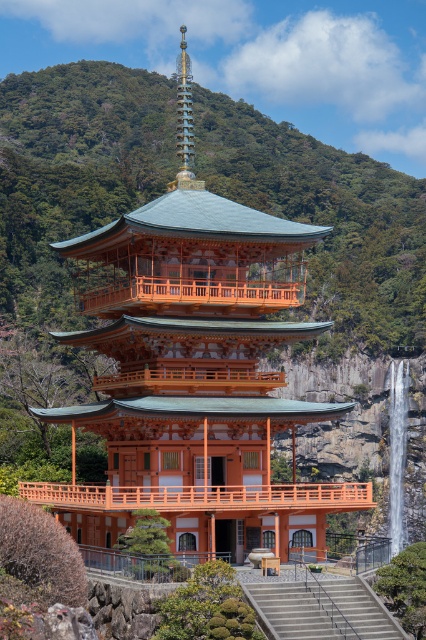
Which is more to the right, concrete/steps at lower center or white smooth waterfall at center right?

white smooth waterfall at center right

Can you confirm if concrete/steps at lower center is positioned below white smooth waterfall at center right?

Actually, concrete/steps at lower center is above white smooth waterfall at center right.

Who is more forward, (336,589) or (397,406)?

Positioned in front is point (336,589).

This screenshot has height=640, width=426. What are the coordinates of `concrete/steps at lower center` in the screenshot? It's located at (290, 611).

Is orange wood pagoda at center above white smooth waterfall at center right?

Correct, orange wood pagoda at center is located above white smooth waterfall at center right.

Is orange wood pagoda at center closer to camera compared to white smooth waterfall at center right?

Yes, it is.

Who is more distant from viewer, (227,212) or (400,404)?

The point (400,404) is behind.

This screenshot has height=640, width=426. What are the coordinates of `orange wood pagoda at center` in the screenshot? It's located at (193, 371).

From the picture: Does orange wood pagoda at center have a larger size compared to concrete/steps at lower center?

Correct, orange wood pagoda at center is larger in size than concrete/steps at lower center.

Is the position of orange wood pagoda at center less distant than that of concrete/steps at lower center?

That is False.

Based on the photo, who is more distant from viewer, (299, 410) or (293, 589)?

The point (299, 410) is behind.

Find the location of a particular element. This screenshot has width=426, height=640. orange wood pagoda at center is located at coordinates (193, 371).